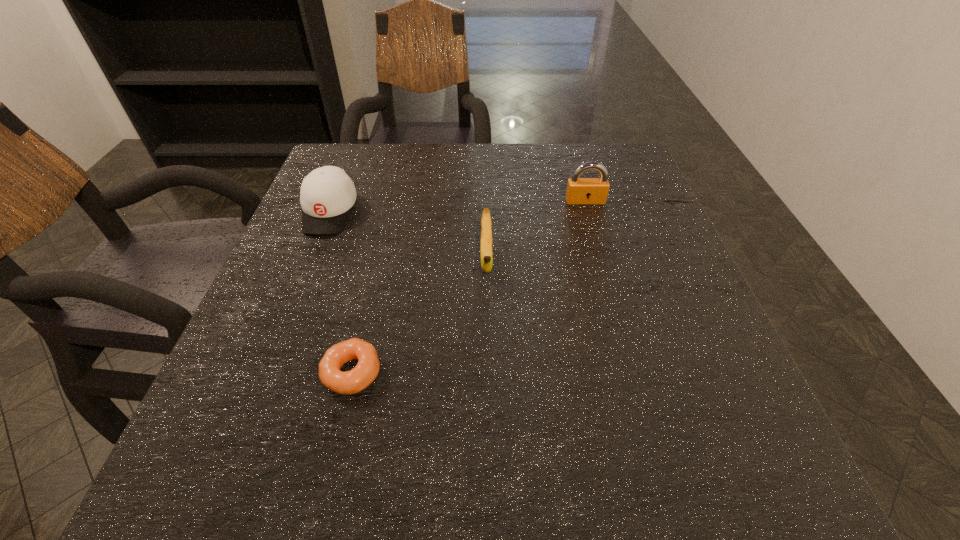
The image size is (960, 540). I want to click on the third closest object to the third object from right to left, so click(x=580, y=191).

Locate an element on the screen. Image resolution: width=960 pixels, height=540 pixels. free space in the image that satisfies the following two spatial constraints: 1. on the front-facing side of the leftmost object; 2. on the right side of the nearest object is located at coordinates (266, 373).